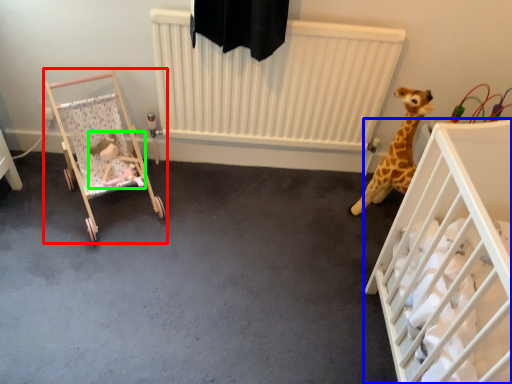
Question: Which object is positioned closest to infant bed (highlighted by a red box)? Select from infant bed (highlighted by a blue box) and toy (highlighted by a green box).

Choices:
 (A) infant bed
 (B) toy

Answer: (B)